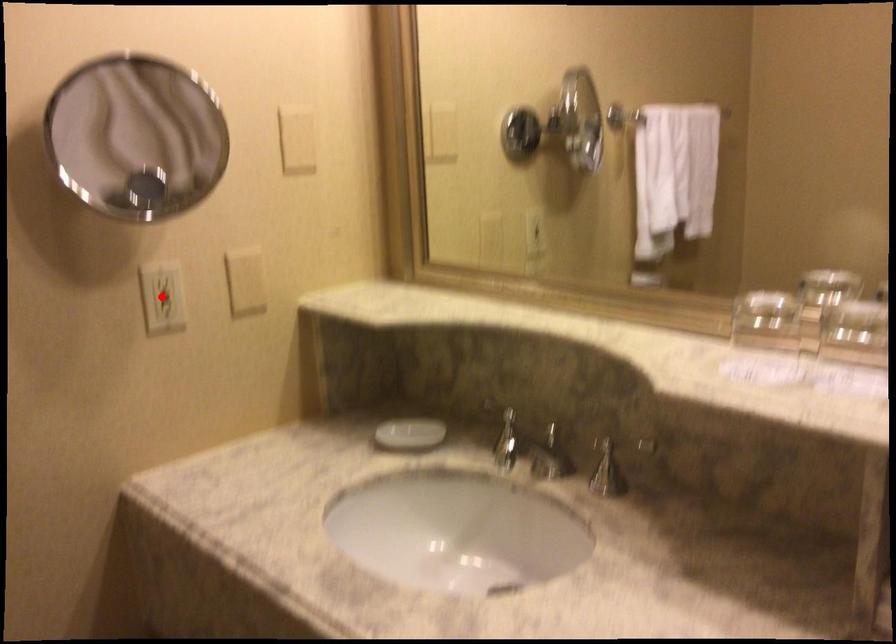
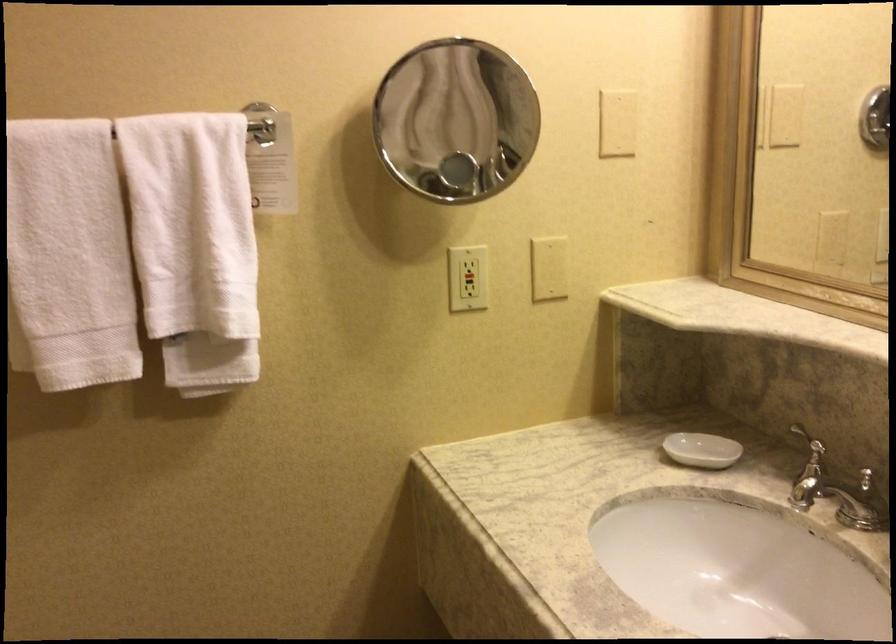
Locate, in the second image, the point that corresponds to the highlighted location in the first image.

(467, 278)